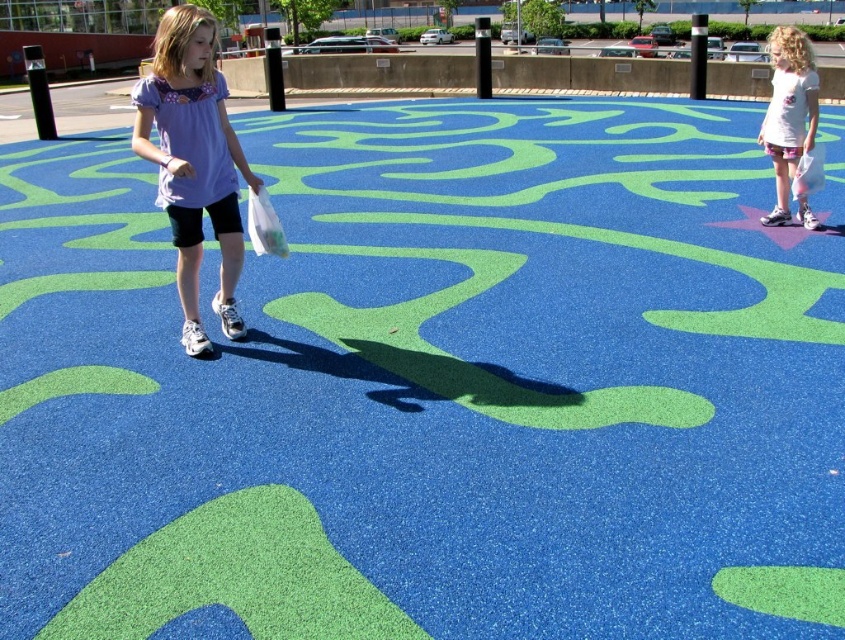
Which is below, matte purple shirt at center or white cotton t-shirt at upper right?

matte purple shirt at center

Is matte purple shirt at center taller than white cotton t-shirt at upper right?

Incorrect, matte purple shirt at center's height is not larger of white cotton t-shirt at upper right's.

Between point (197, 337) and point (788, 44), which one is positioned in front?

Point (197, 337) is more forward.

Locate an element on the screen. The image size is (845, 640). matte purple shirt at center is located at coordinates (194, 161).